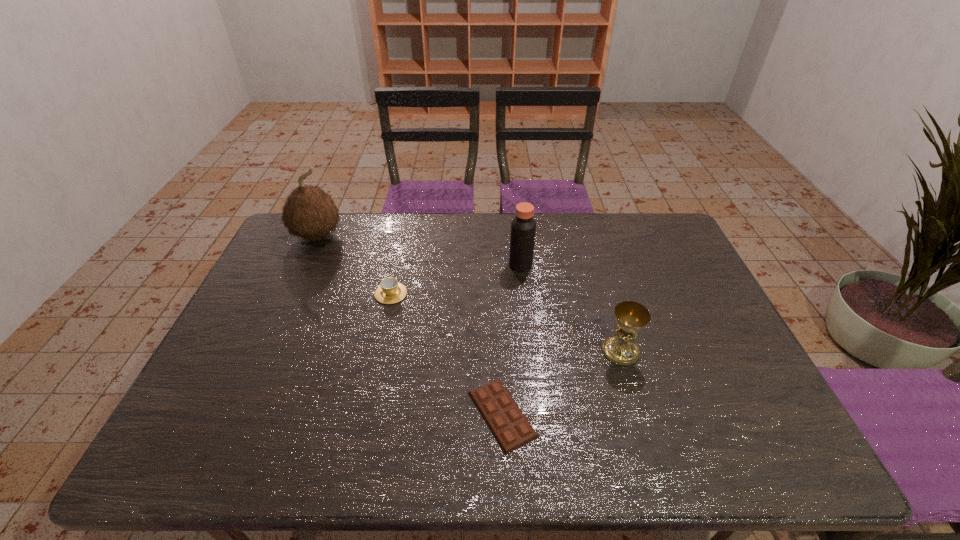
Find the location of a particular element. This screenshot has width=960, height=540. blank region between the chalice and the nearest object is located at coordinates (562, 382).

At what (x,y) coordinates should I click in order to perform the action: click on unoccupied position between the third shortest object and the shortest object. Please return your answer as a coordinate pair (x, y). The height and width of the screenshot is (540, 960). Looking at the image, I should click on (562, 382).

What are the coordinates of `free space between the fourth farthest object and the shortest object` in the screenshot? It's located at (562, 382).

Identify the location of unoccupied area between the nearest object and the second nearest object. This screenshot has width=960, height=540. (562, 382).

Where is `vacant area that lies between the farthest object and the chocolate bar`? This screenshot has width=960, height=540. vacant area that lies between the farthest object and the chocolate bar is located at coordinates (410, 325).

Locate an element on the screen. empty space that is in between the shortest object and the second tallest object is located at coordinates (512, 340).

Select which object appears as the third closest to the second farthest object. Please provide its 2D coordinates. Your answer should be formatted as a tuple, i.e. [(x, y)], where the tuple contains the x and y coordinates of a point satisfying the conditions above.

[(511, 429)]

Point out which object is positioned as the nearest to the chalice. Please provide its 2D coordinates. Your answer should be formatted as a tuple, i.e. [(x, y)], where the tuple contains the x and y coordinates of a point satisfying the conditions above.

[(511, 429)]

The image size is (960, 540). Identify the location of free region that satisfies the following two spatial constraints: 1. on the surface of the rightmost object; 2. on the right side of the farthest object. (265, 351).

You are a GUI agent. You are given a task and a screenshot of the screen. Output one action in this format:
    pyautogui.click(x=<x>, y=<y>)
    Task: Click on the free space that satisfies the following two spatial constraints: 1. on the surface of the nearest object; 2. on the left side of the coconut
    The width and height of the screenshot is (960, 540).
    Given the screenshot: What is the action you would take?
    pyautogui.click(x=236, y=414)